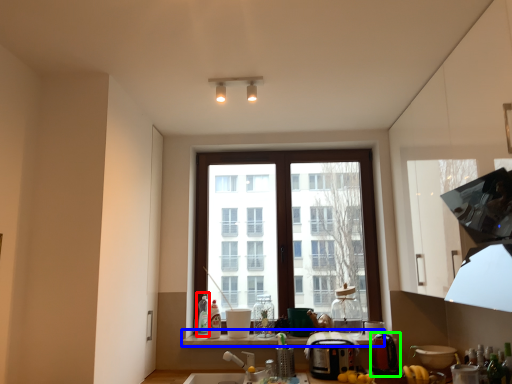
Question: Which object is positioned closest to bottle (highlighted by a red box)? Select from window sill (highlighted by a blue box) and appliance (highlighted by a green box).

Choices:
 (A) window sill
 (B) appliance

Answer: (A)